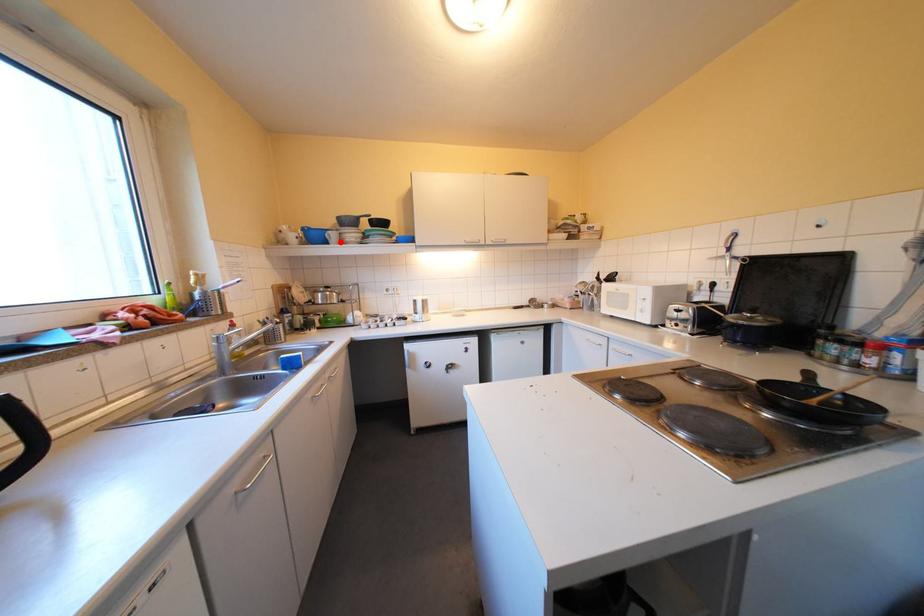
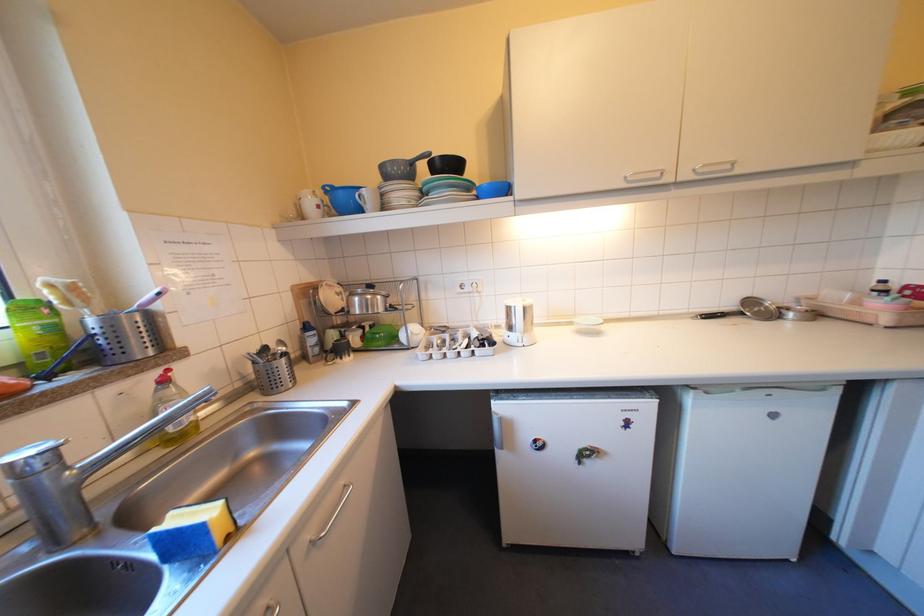
Find the pixel in the second image that matches the highlighted location in the first image.

(373, 209)